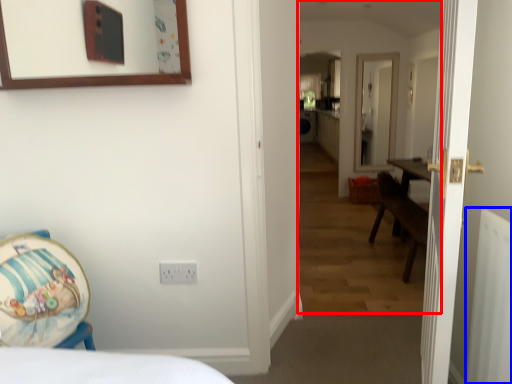
Question: Among these objects, which one is nearest to the camera, corridor (highlighted by a red box) or radiator (highlighted by a blue box)?

Choices:
 (A) corridor
 (B) radiator

Answer: (B)